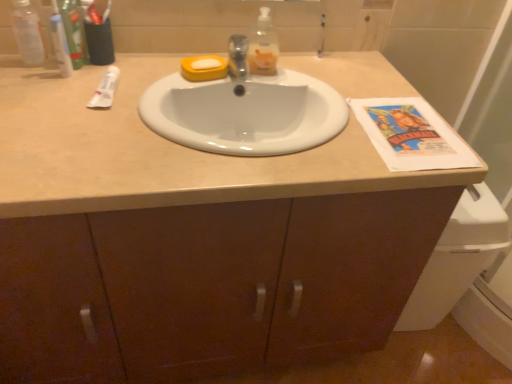
Locate an element on the screen. vacant space to the right of transparent plastic bottle at upper left, acting as the 2th bottle starting from the right is located at coordinates (103, 73).